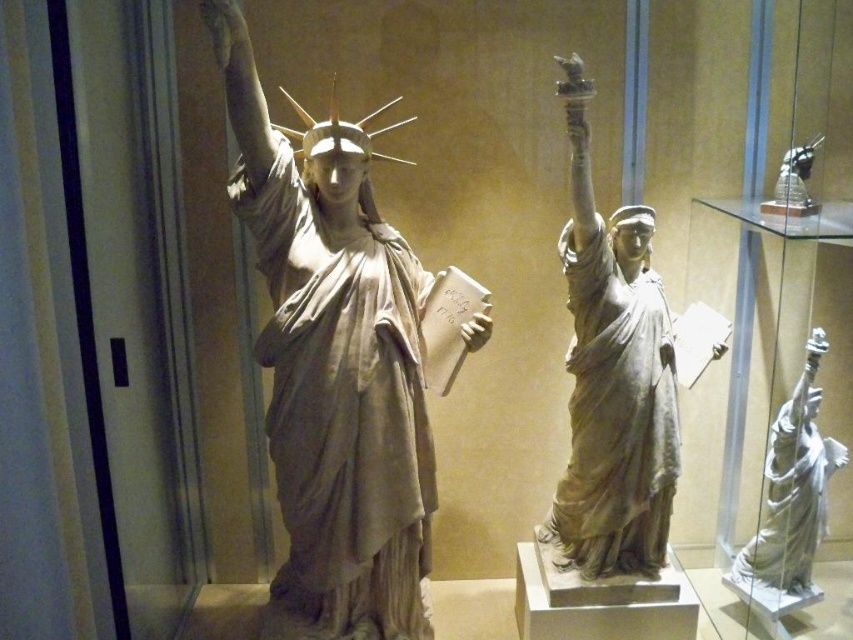
You are a visitor in the museum and want to take a photo of the satin gold statue at upper right without the white marble statue at right blocking the view. Is this possible given their positions?

The satin gold statue at upper right is behind the white marble statue at right, so it would be blocked from view unless you move to a position where the white marble statue at right is not in front of it.

Consider the image. You are an art curator planning to place a new sculpture between the white marble statue at right and the satin gold statue at upper right. Which statue should you consider moving to make space, and why?

You should consider moving the white marble statue at right because it might be wider than the satin gold statue at upper right, allowing more space to accommodate the new sculpture.